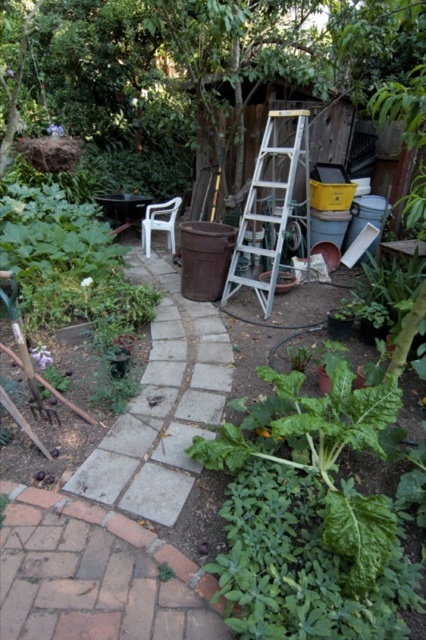
You are standing at the entrance of the garden and want to reach the wooden shed in the background. Which direction should you walk to follow the gray concrete path at center?

The gray concrete path at center is located at point 0.637 on the x axis and 0.383 on the y axis, so you should walk towards the center of the garden to follow the gray concrete path at center.

You are standing at the entrance of the garden and want to reach the silver metallic ladder at center. According to the coordinates given, in which direction should you walk to find it?

The silver metallic ladder at center is located at coordinates point 0.328 on the x axis and 0.643 on the y axis. Since you are at the entrance, you should walk towards the center of the garden where the ladder is positioned.

You are standing in the garden and want to reach the shed. There is a point at coordinates (186, 435) that is 8.55 feet away from you. Can you walk directly to the shed without passing through the plants in the foreground?

The point at coordinates (186, 435) is 8.55 feet away from you. Since the shed is in the background and the plants are in the foreground, the path to the shed would likely go around or beyond the plants, so you can walk directly to the shed without passing through the plants in the foreground.